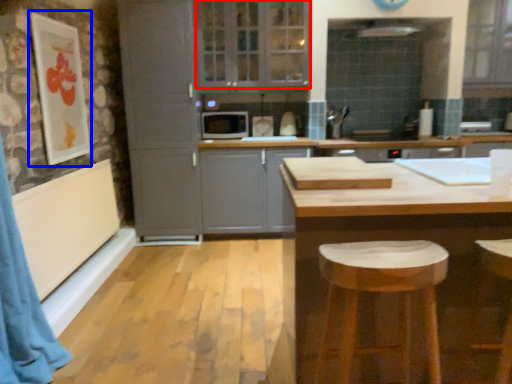
Question: Which object appears farthest to the camera in this image, window (highlighted by a red box) or picture frame (highlighted by a blue box)?

Choices:
 (A) window
 (B) picture frame

Answer: (A)